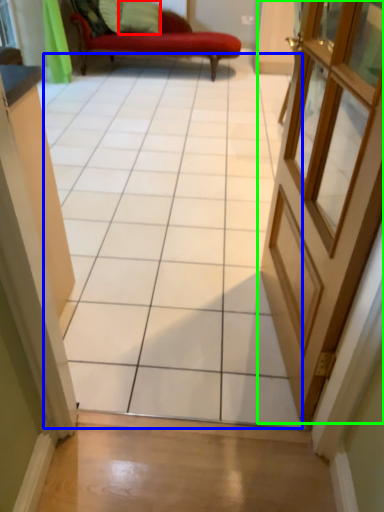
Question: Considering the real-world distances, which object is farthest from pillow (highlighted by a red box)? ceramic tile (highlighted by a blue box) or door (highlighted by a green box)?

Choices:
 (A) ceramic tile
 (B) door

Answer: (B)